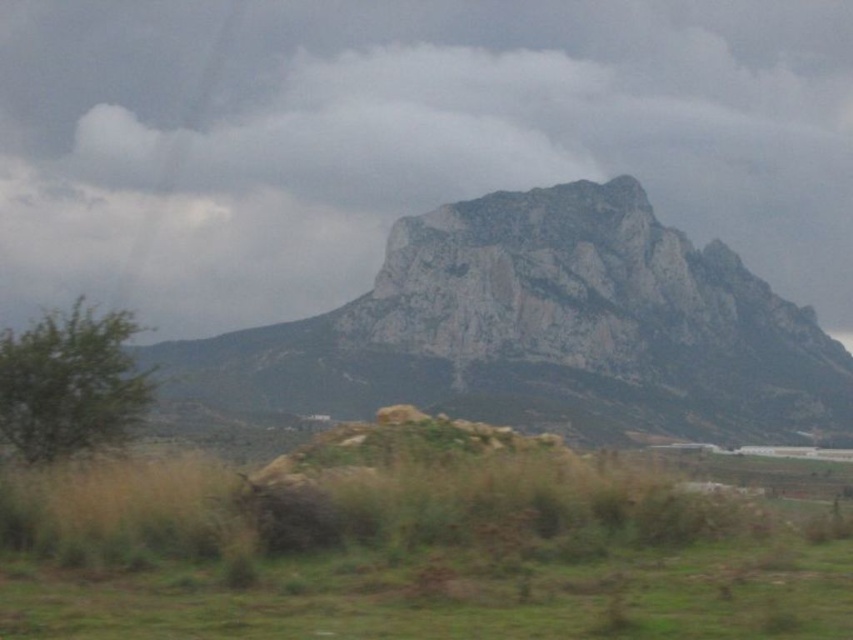
You are standing in the foreground of the landscape and want to look up at the white cloudy sky at upper center. In which direction should you tilt your head?

The white cloudy sky at upper center is located at point coordinates of 0.219 on the x axis and 0.471 on the y axis, so you should tilt your head upwards to look at it.

You are standing at the base of the mountain and want to reach the point marked at coordinate point (331,552). Given that you can walk 100 feet before needing to rest, will you be able to reach the point without resting?

The distance between you and point (331,552) is 61.75 feet, which is less than 100 feet. Therefore, you can reach the point without needing to rest.

You are a hiker planning to cross the grassy area in the image. You see the white cloudy sky at upper center and the green grass at lower center. Which object is located higher in the scene?

The white cloudy sky at upper center is located higher than the green grass at lower center.